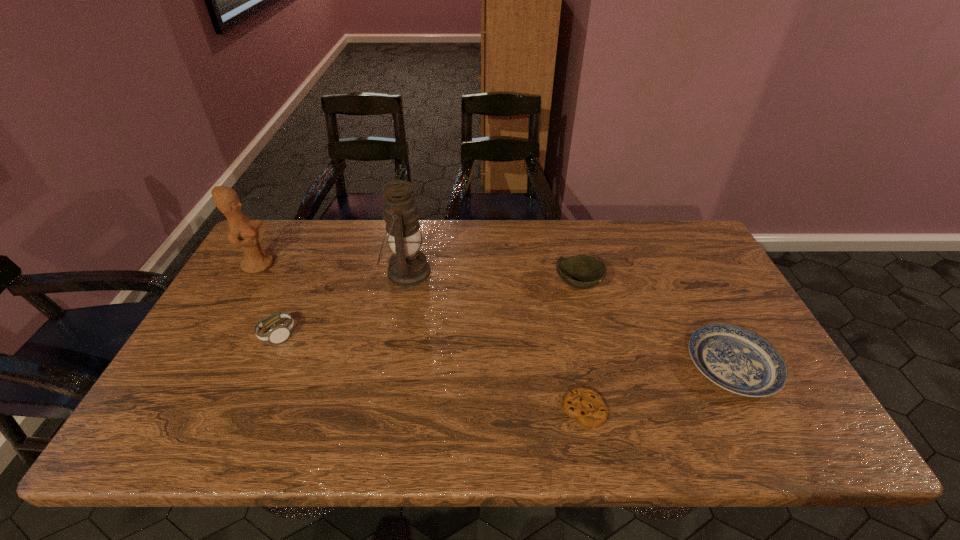
The image size is (960, 540). What are the coordinates of `vacant space that's between the oil lamp and the shortest object` in the screenshot? It's located at (495, 341).

Find the location of a particular element. The height and width of the screenshot is (540, 960). empty location between the oil lamp and the leftmost object is located at coordinates (332, 268).

Where is `free spot between the rightmost object and the watch`? free spot between the rightmost object and the watch is located at coordinates (505, 350).

The height and width of the screenshot is (540, 960). Identify the location of free space between the third object from left to right and the bowl. (492, 278).

You are a GUI agent. You are given a task and a screenshot of the screen. Output one action in this format:
    pyautogui.click(x=<x>, y=<y>)
    Task: Click on the empty location between the shortest object and the fourth object from right to left
    This screenshot has height=540, width=960.
    Given the screenshot: What is the action you would take?
    pyautogui.click(x=495, y=341)

Image resolution: width=960 pixels, height=540 pixels. I want to click on object that stands as the third closest to the watch, so click(x=585, y=405).

Point out which object is positioned as the third nearest to the leftmost object. Please provide its 2D coordinates. Your answer should be formatted as a tuple, i.e. [(x, y)], where the tuple contains the x and y coordinates of a point satisfying the conditions above.

[(582, 271)]

You are a GUI agent. You are given a task and a screenshot of the screen. Output one action in this format:
    pyautogui.click(x=<x>, y=<y>)
    Task: Click on the vacant region that satisfies the following two spatial constraints: 1. on the front-facing side of the figurine; 2. on the left side of the fifth tallest object
    This screenshot has width=960, height=540.
    Given the screenshot: What is the action you would take?
    pyautogui.click(x=201, y=366)

Identify the location of blank area in the image that satisfies the following two spatial constraints: 1. on the face of the second object from left to right; 2. on the back side of the cookie. (244, 410).

Find the location of a particular element. Image resolution: width=960 pixels, height=540 pixels. vacant space that satisfies the following two spatial constraints: 1. on the back side of the bowl; 2. on the left side of the shortest object is located at coordinates (560, 284).